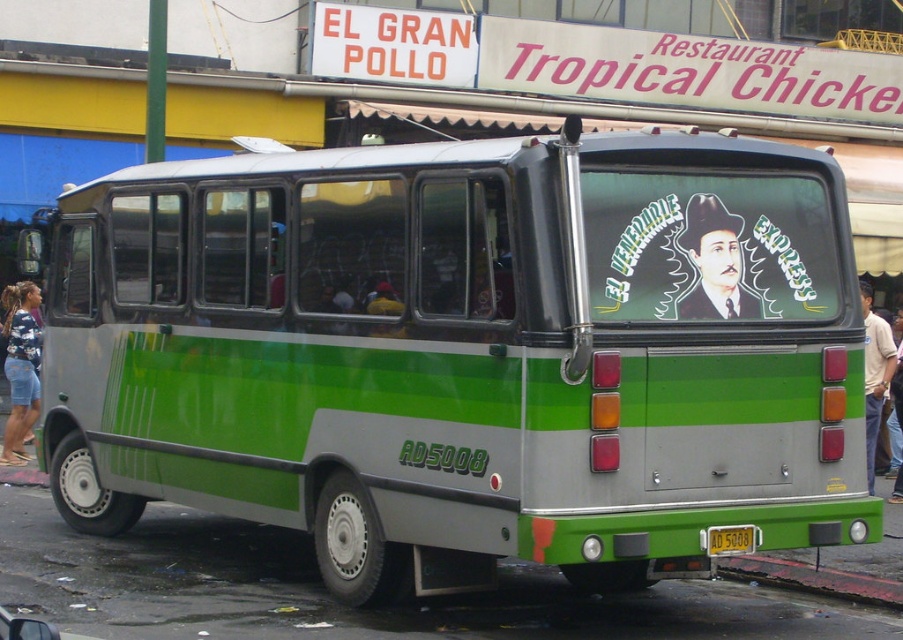
You are a delivery driver who needs to check the license plate of the bus to confirm the delivery address. However, you are standing at the back of the bus and can only see the objects mentioned. Can you see the yellow plastic license plate at rear clearly while also seeing the smooth black hat at rear center?

The smooth black hat at rear center is bigger than the yellow plastic license plate at rear, so the hat might block the view of the license plate, making it hard to see clearly.

You are standing on the street and see the bus with the AD5008 plate and the restaurant sign. You want to walk to the point marked at coordinates (678,244). Is this point closer to you than 7 meters?

The distance of point (678,244) from viewer is 6.74 meters, so yes, the point is closer than 7 meters.

You are a pedestrian standing on the sidewalk. You see the green matte bus at center and the denim shorts at left. Which object is closer to your left side?

The denim shorts at left are closer to your left side since the green matte bus at center is to the right of denim shorts at left.